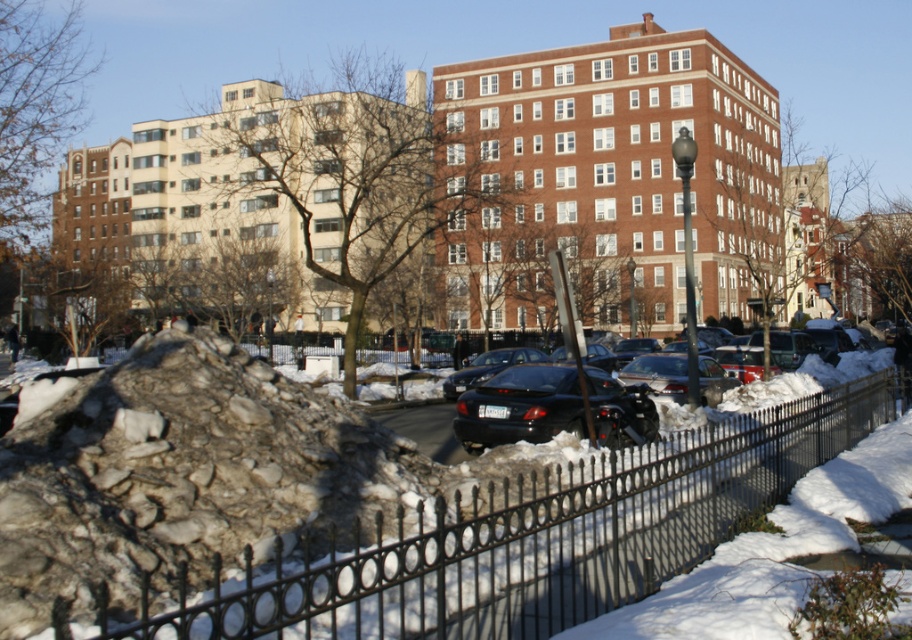
You are standing in the urban winter scene and want to take a photo of both point (382, 570) and point (9, 556). Which point should you focus on first to ensure both are in clear view?

Point (382, 570) is closer to the camera than point (9, 556), so you should focus on point (382, 570) first to ensure both are in clear view.

You are a city planner reviewing this area for safety. The black wrought iron fence at lower center and the rocky debris at lower left are present. Based on their positions, which object is closer to the street where the cars are parked?

The black wrought iron fence at lower center is positioned under rocky debris at lower left, so the fence is closer to the street where the cars are parked because it is located beneath the debris.

You are a delivery person trying to navigate through the urban winter scene. You see the black wrought iron fence at lower center and the black matte car at center. Which object is positioned lower in the image?

The black wrought iron fence at lower center is positioned below the black matte car at center, so it is lower in the image.